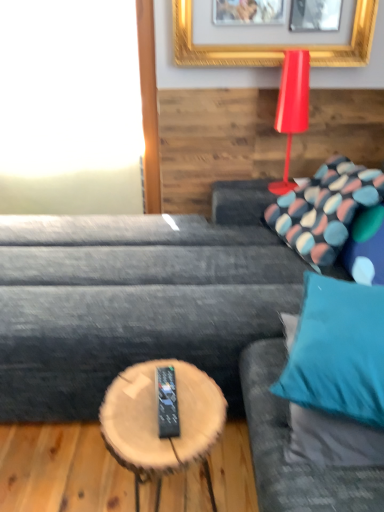
The width and height of the screenshot is (384, 512). Describe the element at coordinates (292, 108) in the screenshot. I see `shiny red table lamp at upper right` at that location.

The image size is (384, 512). What do you see at coordinates (157, 418) in the screenshot?
I see `wooden log coffee table at center` at bounding box center [157, 418].

This screenshot has width=384, height=512. Identify the location of wooden log coffee table at center. (157, 418).

Measure the distance between dark gray fabric couch at center and camera.

1.30 meters.

The image size is (384, 512). What do you see at coordinates (338, 351) in the screenshot?
I see `teal fabric pillow at right, positioned as the 1th pillow in front-to-back order` at bounding box center [338, 351].

Locate an element on the screen. shiny red table lamp at upper right is located at coordinates (292, 108).

Between teal fabric couch at right and shiny red table lamp at upper right, which one is positioned in front?

teal fabric couch at right is closer to the camera.

Which object is positioned more to the left, teal fabric couch at right or shiny red table lamp at upper right?

teal fabric couch at right.

Is teal fabric couch at right taller or shorter than shiny red table lamp at upper right?

In the image, teal fabric couch at right appears to be taller than shiny red table lamp at upper right.

Would you say shiny red table lamp at upper right is part of teal fabric couch at right's contents?

No, shiny red table lamp at upper right is located outside of teal fabric couch at right.

From a real-world perspective, is wooden log coffee table at center physically located above or below teal fabric couch at right?

In terms of real-world spatial position, wooden log coffee table at center is below teal fabric couch at right.

Considering the sizes of objects wooden log coffee table at center and teal fabric couch at right in the image provided, who is wider, wooden log coffee table at center or teal fabric couch at right?

teal fabric couch at right is wider.

From the image's perspective, is wooden log coffee table at center positioned above or below teal fabric couch at right?

A: From the image's perspective, wooden log coffee table at center appears below teal fabric couch at right.

What's the angular difference between dark gray fabric couch at center and white glass window at upper left's facing directions?

The angular difference between dark gray fabric couch at center and white glass window at upper left is 90.3 degrees.

Considering the relative positions of dark gray fabric couch at center and white glass window at upper left in the image provided, is dark gray fabric couch at center to the left or to the right of white glass window at upper left?

From the image, it's evident that dark gray fabric couch at center is to the right of white glass window at upper left.

Consider the image. Is dark gray fabric couch at center positioned beyond the bounds of white glass window at upper left?

Indeed, dark gray fabric couch at center is completely outside white glass window at upper left.

From a real-world perspective, is dark gray fabric couch at center on top of white glass window at upper left?

No, from a real-world perspective, dark gray fabric couch at center is not on top of white glass window at upper left.

Which is closer, (326, 291) or (306, 78)?

Point (326, 291) appears to be closer to the viewer than point (306, 78).

From the picture: Is teal fabric pillow at right, arranged as the 2th pillow when viewed from the top, facing away from shiny red table lamp at upper right?

Yes, teal fabric pillow at right, arranged as the 2th pillow when viewed from the top,'s orientation is away from shiny red table lamp at upper right.

Is teal fabric pillow at right, positioned as the 1th pillow in front-to-back order, wider or thinner than shiny red table lamp at upper right?

teal fabric pillow at right, positioned as the 1th pillow in front-to-back order, is wider than shiny red table lamp at upper right.

Can we say teal fabric pillow at right, the 2th pillow when ordered from back to front, lies outside shiny red table lamp at upper right?

Indeed, teal fabric pillow at right, the 2th pillow when ordered from back to front, is completely outside shiny red table lamp at upper right.

From the image's perspective, is wooden log coffee table at center located above or below teal fabric pillow at right, positioned as the 1th pillow in front-to-back order?

wooden log coffee table at center is situated lower than teal fabric pillow at right, positioned as the 1th pillow in front-to-back order, in the image.

Could you tell me if wooden log coffee table at center is turned towards teal fabric pillow at right, arranged as the 2th pillow when viewed from the top?

No.

How different are the orientations of wooden log coffee table at center and teal fabric pillow at right, arranged as the 2th pillow when viewed from the top, in degrees?

The facing directions of wooden log coffee table at center and teal fabric pillow at right, arranged as the 2th pillow when viewed from the top, are 23.5 degrees apart.

Is the surface of wooden log coffee table at center in direct contact with teal fabric pillow at right, arranged as the 2th pillow when viewed from the top?

No, wooden log coffee table at center is not beside teal fabric pillow at right, arranged as the 2th pillow when viewed from the top.

From a real-world perspective, is teal fabric couch at right positioned above or below teal fabric pillow at right, the 2th pillow when ordered from back to front?

teal fabric couch at right is below teal fabric pillow at right, the 2th pillow when ordered from back to front.

How many degrees apart are the facing directions of teal fabric couch at right and teal fabric pillow at right, the 2th pillow when ordered from back to front?

They differ by 71.7 degrees in their facing directions.

Which of these two, teal fabric couch at right or teal fabric pillow at right, arranged as the 2th pillow when viewed from the top, stands taller?

Standing taller between the two is teal fabric couch at right.

Choose the correct answer: Is teal fabric couch at right inside teal fabric pillow at right, the 2th pillow when ordered from back to front, or outside it?

teal fabric couch at right is located beyond the bounds of teal fabric pillow at right, the 2th pillow when ordered from back to front.

Is teal fabric pillow at right, arranged as the 2th pillow when viewed from the top, not inside patterned fabric pillow at upper right, the 1th pillow viewed from the top?

teal fabric pillow at right, arranged as the 2th pillow when viewed from the top, lies outside patterned fabric pillow at upper right, the 1th pillow viewed from the top,'s area.

Can you confirm if teal fabric pillow at right, the 1th pillow ordered from the bottom, is bigger than patterned fabric pillow at upper right, the 1th pillow viewed from the top?

Actually, teal fabric pillow at right, the 1th pillow ordered from the bottom, might be smaller than patterned fabric pillow at upper right, the 1th pillow viewed from the top.

Where is `pillow below the teal fabric pillow at right, positioned as the 1th pillow in front-to-back order (from a real-world perspective)`? Image resolution: width=384 pixels, height=512 pixels. pillow below the teal fabric pillow at right, positioned as the 1th pillow in front-to-back order (from a real-world perspective) is located at coordinates (325, 208).

From a real-world perspective, is teal fabric pillow at right, arranged as the 2th pillow when viewed from the top, located higher than patterned fabric pillow at upper right, the 2th pillow from the front?

Indeed, from a real-world perspective, teal fabric pillow at right, arranged as the 2th pillow when viewed from the top, stands above patterned fabric pillow at upper right, the 2th pillow from the front.

Where is `couch in front of the shiny red table lamp at upper right`? The height and width of the screenshot is (512, 384). couch in front of the shiny red table lamp at upper right is located at coordinates (288, 441).

Locate an element on the screen. This screenshot has width=384, height=512. coffee table below the teal fabric couch at right (from the image's perspective) is located at coordinates (157, 418).

Based on their spatial positions, is teal fabric pillow at right, positioned as the 1th pillow in front-to-back order, or dark gray fabric couch at center closer to shiny red table lamp at upper right?

Among the two, dark gray fabric couch at center is located nearer to shiny red table lamp at upper right.

Looking at the image, which one is located closer to teal fabric couch at right, wooden log coffee table at center or white glass window at upper left?

Among the two, wooden log coffee table at center is located nearer to teal fabric couch at right.

Considering their positions, is white glass window at upper left positioned further to shiny red table lamp at upper right than patterned fabric pillow at upper right, the second pillow when ordered from bottom to top?

white glass window at upper left is further to shiny red table lamp at upper right.

Looking at the image, which one is located further to teal fabric pillow at right, the 1th pillow ordered from the bottom, white glass window at upper left or dark gray fabric couch at center?

Based on the image, white glass window at upper left appears to be further to teal fabric pillow at right, the 1th pillow ordered from the bottom.

From the image, which object appears to be farther from patterned fabric pillow at upper right, the 1th pillow viewed from the top, teal fabric pillow at right, arranged as the 2th pillow when viewed from the top, or wooden log coffee table at center?

wooden log coffee table at center is positioned further to the anchor patterned fabric pillow at upper right, the 1th pillow viewed from the top.

Considering their positions, is white glass window at upper left positioned further to dark gray fabric couch at center than teal fabric pillow at right, the 2th pillow when ordered from back to front?

white glass window at upper left lies further to dark gray fabric couch at center than the other object.

When comparing their distances from white glass window at upper left, does patterned fabric pillow at upper right, the second pillow when ordered from bottom to top, or wooden log coffee table at center seem closer?

The object closer to white glass window at upper left is patterned fabric pillow at upper right, the second pillow when ordered from bottom to top.

When comparing their distances from teal fabric pillow at right, positioned as the 1th pillow in front-to-back order, does white glass window at upper left or teal fabric couch at right seem closer?

Based on the image, teal fabric couch at right appears to be nearer to teal fabric pillow at right, positioned as the 1th pillow in front-to-back order.

Find the location of a particular element. studio couch between white glass window at upper left and shiny red table lamp at upper right is located at coordinates click(131, 306).

Identify the location of table lamp between teal fabric pillow at right, the 1th pillow ordered from the bottom, and white glass window at upper left in the front-back direction. This screenshot has width=384, height=512. (292, 108).

At what (x,y) coordinates should I click in order to perform the action: click on studio couch located between teal fabric couch at right and patterned fabric pillow at upper right, the 2th pillow from the front, in the depth direction. Please return your answer as a coordinate pair (x, y). The image size is (384, 512). Looking at the image, I should click on (131, 306).

Identify the location of couch between dark gray fabric couch at center and wooden log coffee table at center from top to bottom. This screenshot has height=512, width=384. (288, 441).